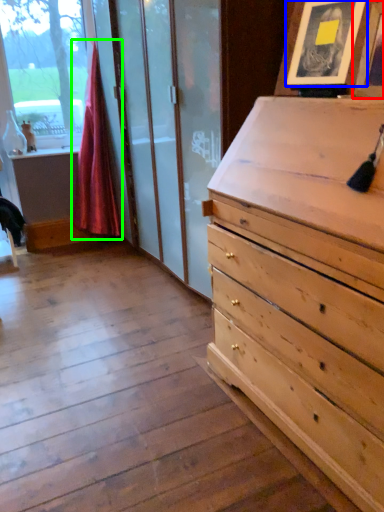
Question: Based on their relative distances, which object is nearer to picture frame (highlighted by a red box)? Choose from picture frame (highlighted by a blue box) and curtain (highlighted by a green box).

Choices:
 (A) picture frame
 (B) curtain

Answer: (A)